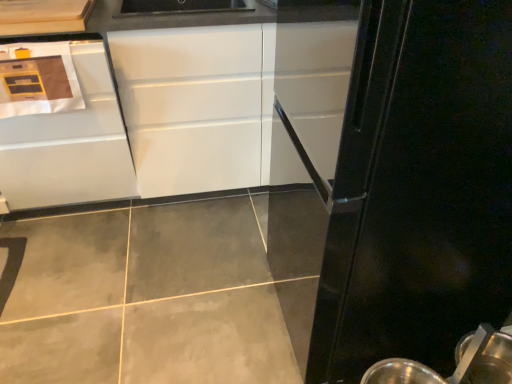
Question: From the image's perspective, is black glossy refrigerator at right located above or below white glossy cabinet at center, the first cabinetry positioned from the right?

Choices:
 (A) below
 (B) above

Answer: (A)

Question: From their relative heights in the image, would you say black glossy refrigerator at right is taller or shorter than white glossy cabinet at center, the first cabinetry positioned from the right?

Choices:
 (A) short
 (B) tall

Answer: (B)

Question: Estimate the real-world distances between objects in this image. Which object is farther from the metallic silver spoon at lower right?

Choices:
 (A) white glossy cabinet at left, the 1th cabinetry from the left
 (B) white glossy cabinet at center, acting as the 2th cabinetry starting from the left
 (C) black glossy refrigerator at right

Answer: (A)

Question: Considering the real-world distances, which object is closest to the metallic silver spoon at lower right?

Choices:
 (A) white glossy cabinet at left, the 1th cabinetry from the left
 (B) black glossy refrigerator at right
 (C) white glossy cabinet at center, the first cabinetry positioned from the right

Answer: (B)